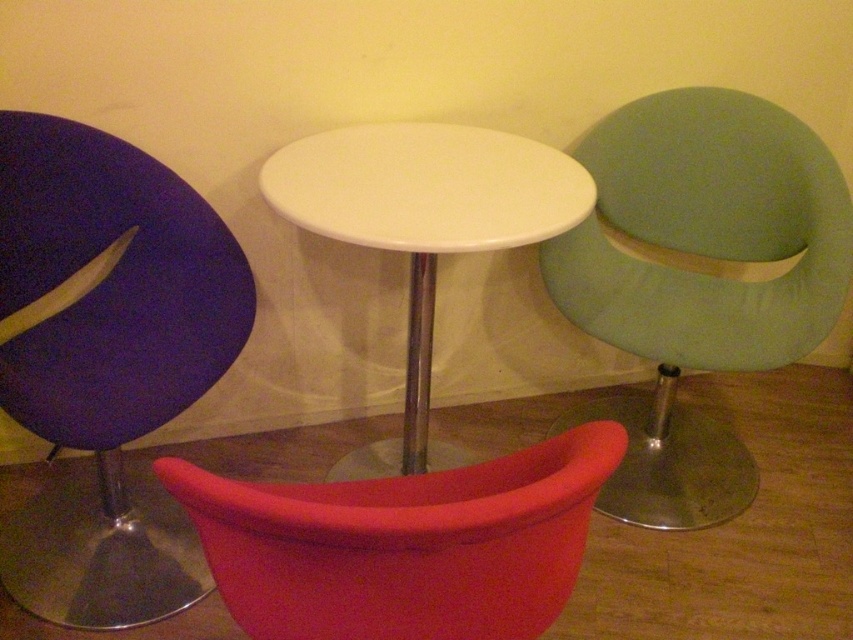
You are sitting on the floor and want to reach the matte purple chair at left and the matte green armchair at right. Which chair will you need to stretch less to reach?

The matte purple chair at left has a lesser height compared to the matte green armchair at right, so you will need to stretch less to reach the matte purple chair at left.

From the picture: You are standing in the room and want to move to the center of the table. Which direction should you move from the matte purple chair at left to reach the center of the table?

The matte purple chair at left is located at point (x=108, y=365). Since the table is in the center of the frame, you would need to move towards the center from the left position of the chair.